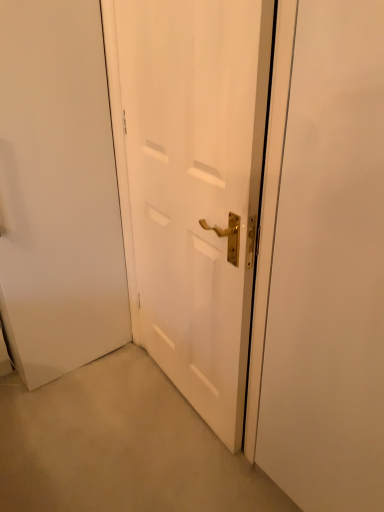
Locate an element on the screen. This screenshot has height=512, width=384. white matte door at center is located at coordinates (196, 187).

The image size is (384, 512). What do you see at coordinates (196, 187) in the screenshot?
I see `white matte door at center` at bounding box center [196, 187].

The image size is (384, 512). What do you see at coordinates (329, 268) in the screenshot?
I see `white matte door at center` at bounding box center [329, 268].

Where is `white matte door at center`? white matte door at center is located at coordinates (329, 268).

Find the location of a particular element. The height and width of the screenshot is (512, 384). white matte door at center is located at coordinates [196, 187].

Considering the relative positions of white matte door at center and white matte door at center in the image provided, is white matte door at center to the left of white matte door at center from the viewer's perspective?

Yes, white matte door at center is to the left of white matte door at center.

Which object is further away from the camera, white matte door at center or white matte door at center?

white matte door at center is behind.

Which is closer to the camera, [135,116] or [332,269]?

Point [135,116] is farther from the camera than point [332,269].

From the image's perspective, is white matte door at center located above or below white matte door at center?

white matte door at center is above white matte door at center.

From a real-world perspective, is white matte door at center positioned over white matte door at center based on gravity?

Yes, from a real-world perspective, white matte door at center is over white matte door at center

Considering the sizes of objects white matte door at center and white matte door at center in the image provided, who is wider, white matte door at center or white matte door at center?

With larger width is white matte door at center.

Does white matte door at center have a greater height compared to white matte door at center?

Indeed, white matte door at center has a greater height compared to white matte door at center.

In the scene shown: Is white matte door at center bigger or smaller than white matte door at center?

Considering their sizes, white matte door at center takes up more space than white matte door at center.

Is white matte door at center surrounding white matte door at center?

No, white matte door at center is not inside white matte door at center.

Is white matte door at center not near white matte door at center?

They are positioned close to each other.

Is white matte door at center facing towards white matte door at center?

No, white matte door at center does not turn towards white matte door at center.

Measure the distance between white matte door at center and white matte door at center.

A distance of 13.15 inches exists between white matte door at center and white matte door at center.

Identify the location of door above the white matte door at center (from a real-world perspective). (196, 187).

Is white matte door at center to the left of white matte door at center from the viewer's perspective?

In fact, white matte door at center is to the right of white matte door at center.

Is white matte door at center in front of white matte door at center?

Yes, the depth of white matte door at center is less than that of white matte door at center.

Which is behind, point (265, 364) or point (143, 258)?

The point (143, 258) is farther from the camera.

From the image's perspective, would you say white matte door at center is shown under white matte door at center?

Yes, from the image's perspective, white matte door at center is beneath white matte door at center.

From a real-world perspective, is white matte door at center positioned over white matte door at center based on gravity?

No, from a real-world perspective, white matte door at center is not above white matte door at center.

Is white matte door at center wider or thinner than white matte door at center?

Considering their sizes, white matte door at center looks broader than white matte door at center.

Who is taller, white matte door at center or white matte door at center?

white matte door at center is taller.

Does white matte door at center have a smaller size compared to white matte door at center?

Yes.

Can we say white matte door at center lies outside white matte door at center?

Yes.

Is white matte door at center beside white matte door at center?

No, white matte door at center is not touching white matte door at center.

Could you tell me if white matte door at center is turned towards white matte door at center?

No.

I want to click on screen door below the white matte door at center (from a real-world perspective), so click(x=329, y=268).

Identify the location of screen door below the white matte door at center (from the image's perspective). (329, 268).

In order to click on screen door on the right of white matte door at center in this screenshot , I will do `click(329, 268)`.